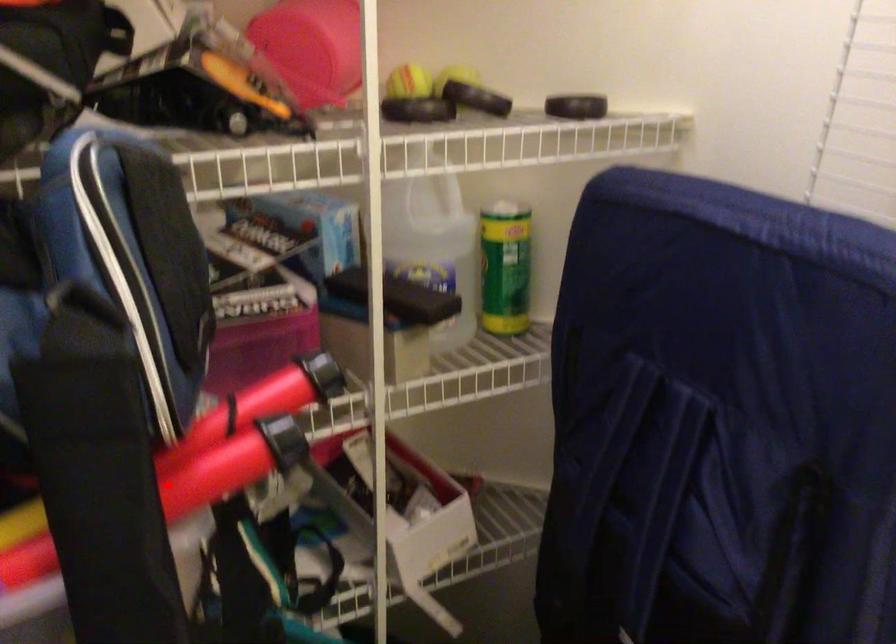
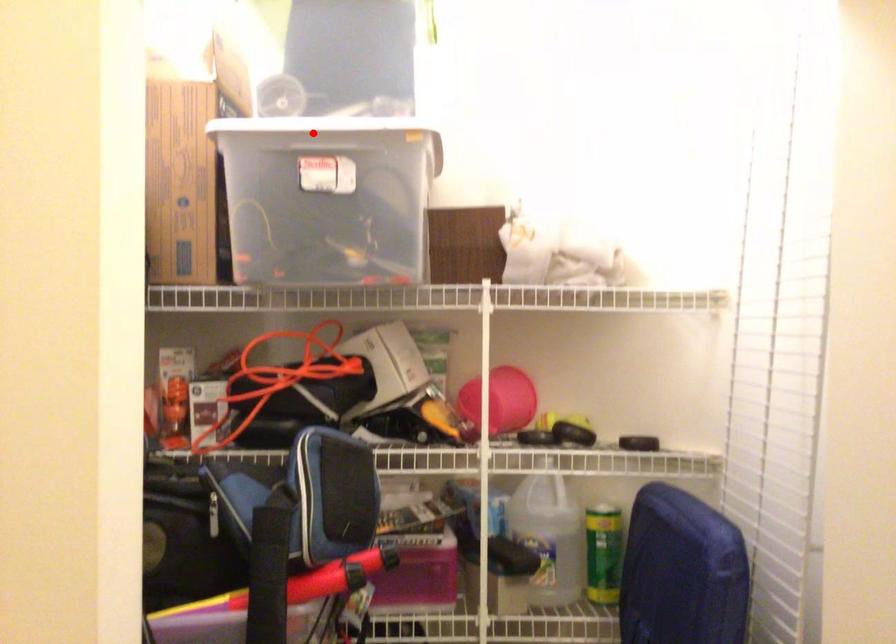
I am providing you with two images of the same scene from different viewpoints. A red point is marked on the first image and another point is marked on the second image. Is the marked point in image1 the same physical position as the marked point in image2?

No